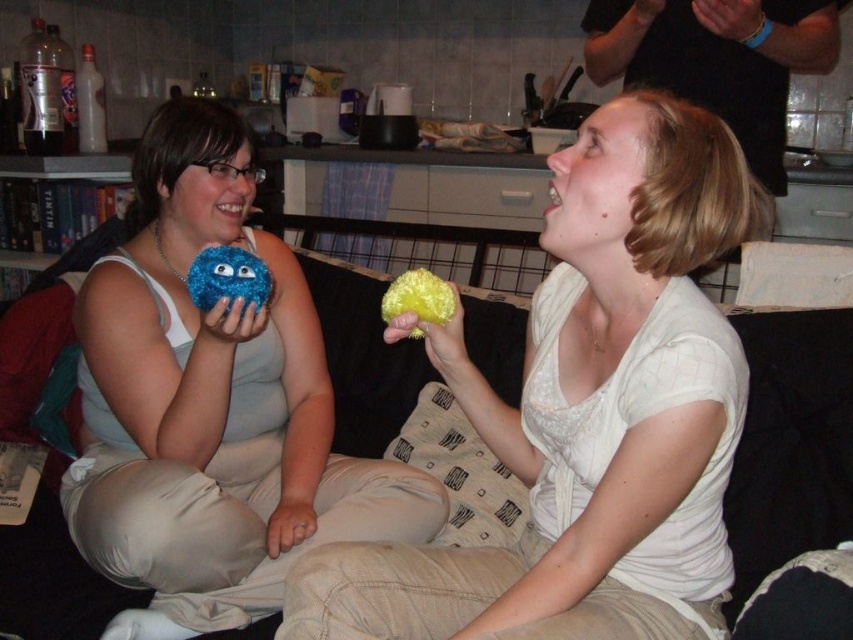
Question: Which object is the farthest from the yellow fuzzy ball at upper right?

Choices:
 (A) fuzzy blue ball at left
 (B) matte blue plush toy at center
 (C) yellow fuzzy ball at center

Answer: (A)

Question: Is matte blue plush toy at center thinner than yellow fuzzy ball at center?

Choices:
 (A) yes
 (B) no

Answer: (B)

Question: Which of the following is the closest to the observer?

Choices:
 (A) fuzzy blue ball at left
 (B) matte blue plush toy at center

Answer: (A)

Question: Is fuzzy blue ball at left smaller than yellow fuzzy ball at center?

Choices:
 (A) no
 (B) yes

Answer: (A)

Question: Can you confirm if matte blue plush toy at center is positioned to the left of yellow fuzzy ball at center?

Choices:
 (A) yes
 (B) no

Answer: (A)

Question: Which point is closer to the camera?

Choices:
 (A) yellow fuzzy ball at upper right
 (B) matte blue plush toy at center

Answer: (A)